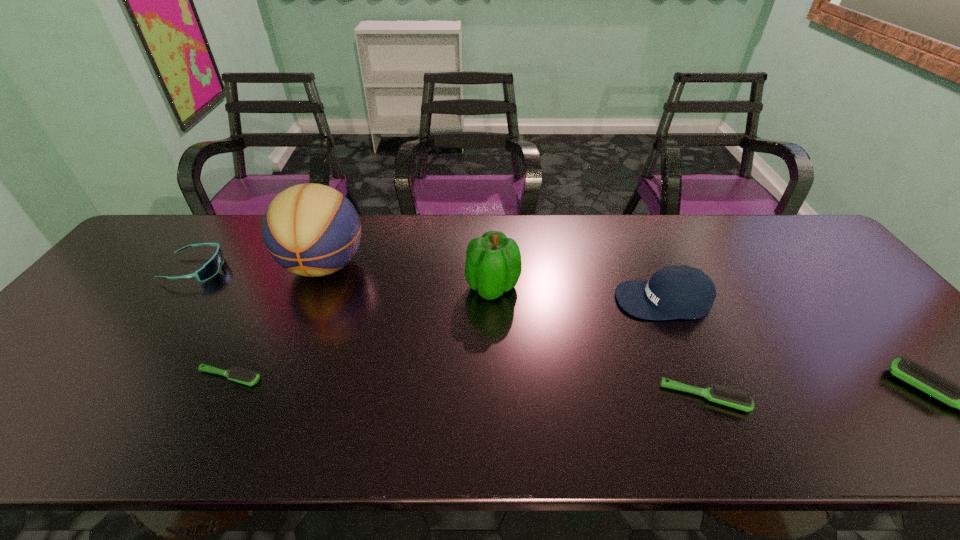
Locate an element on the screen. spot to insert another hairbrush for uniform distribution is located at coordinates (463, 387).